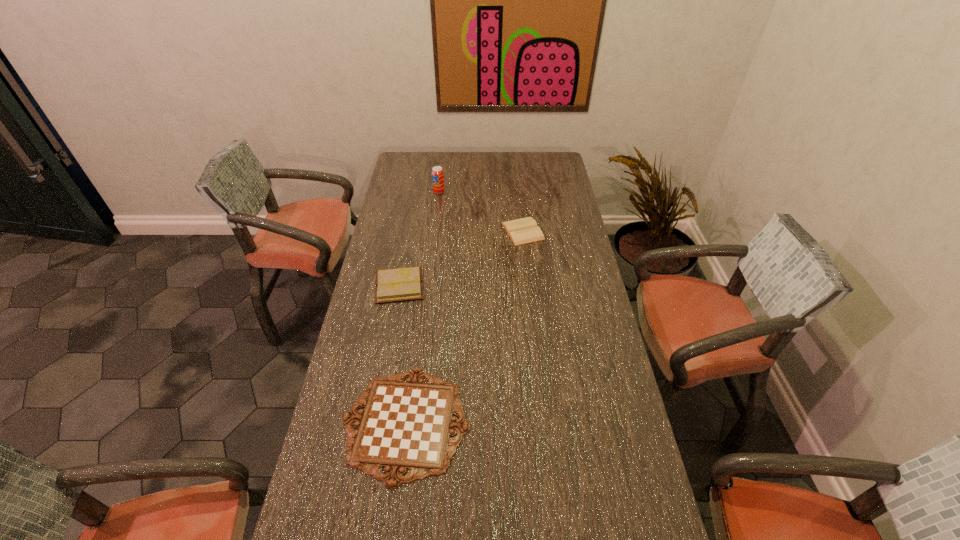
Where is `object that ranks as the third closest to the nearer diary`? object that ranks as the third closest to the nearer diary is located at coordinates (437, 173).

Identify the location of free space in the image that satisfies the following two spatial constraints: 1. on the back side of the left diary; 2. on the left side of the tallest object. (417, 192).

Locate an element on the screen. free space in the image that satisfies the following two spatial constraints: 1. on the back side of the third farthest object; 2. on the right side of the second farthest object is located at coordinates (409, 231).